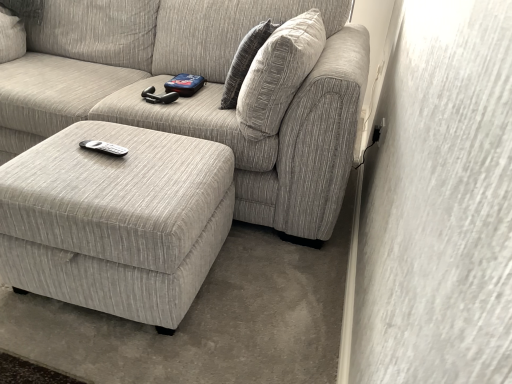
Question: Is textured beige couch at center not within textured gray pillow at upper right?

Choices:
 (A) yes
 (B) no

Answer: (A)

Question: From the image's perspective, would you say textured beige couch at center is positioned over textured gray pillow at upper right?

Choices:
 (A) no
 (B) yes

Answer: (B)

Question: Is there a large distance between textured beige couch at center and textured gray pillow at upper right?

Choices:
 (A) yes
 (B) no

Answer: (B)

Question: Does textured beige couch at center appear on the left side of textured gray pillow at upper right?

Choices:
 (A) yes
 (B) no

Answer: (A)

Question: Are textured beige couch at center and textured gray pillow at upper right beside each other?

Choices:
 (A) yes
 (B) no

Answer: (B)

Question: Is textured gray pillow at upper right in front of or behind textured beige couch at center in the image?

Choices:
 (A) front
 (B) behind

Answer: (B)

Question: From a real-world perspective, is textured gray pillow at upper right above or below textured beige couch at center?

Choices:
 (A) above
 (B) below

Answer: (A)

Question: Is point (227, 77) positioned closer to the camera than point (6, 119)?

Choices:
 (A) farther
 (B) closer

Answer: (B)

Question: Choose the correct answer: Is textured gray pillow at upper right inside textured beige couch at center or outside it?

Choices:
 (A) inside
 (B) outside

Answer: (A)

Question: Is point (0, 69) positioned closer to the camera than point (243, 51)?

Choices:
 (A) closer
 (B) farther

Answer: (B)

Question: Is textured beige couch at center to the left or to the right of textured gray pillow at upper right in the image?

Choices:
 (A) right
 (B) left

Answer: (B)

Question: From a real-world perspective, relative to textured gray pillow at upper right, is textured beige couch at center vertically above or below?

Choices:
 (A) below
 (B) above

Answer: (A)

Question: Relative to textured gray pillow at upper right, is textured beige couch at center in front or behind?

Choices:
 (A) front
 (B) behind

Answer: (A)

Question: From the image's perspective, is textured gray pillow at upper right positioned above or below matte gray ottoman at lower left?

Choices:
 (A) above
 (B) below

Answer: (A)

Question: In terms of size, does textured gray pillow at upper right appear bigger or smaller than matte gray ottoman at lower left?

Choices:
 (A) big
 (B) small

Answer: (B)